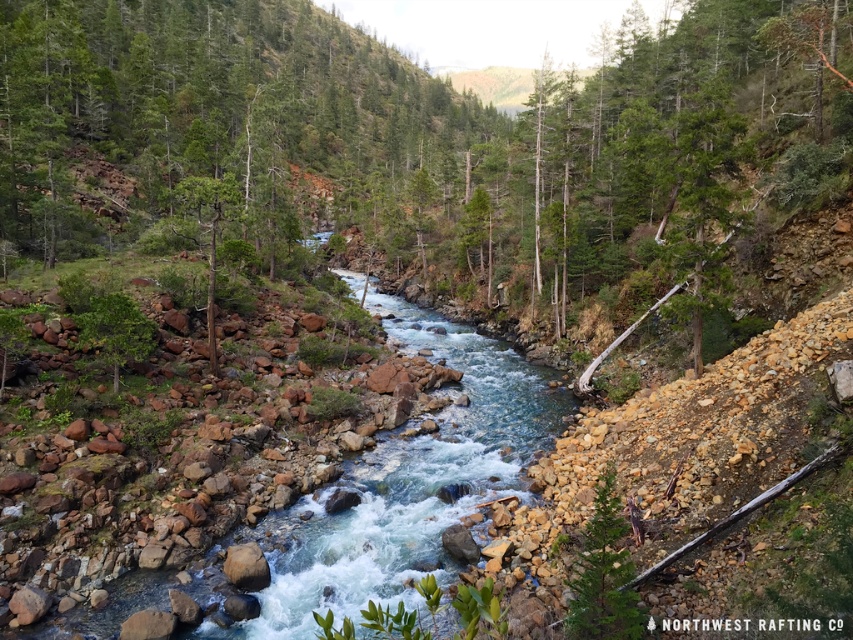
You are standing at the origin point of the scene. Which direction should you move to reach the green matte tree at lower right?

The green matte tree at lower right is located at point [602,577], so you should move towards the lower right direction to reach it.